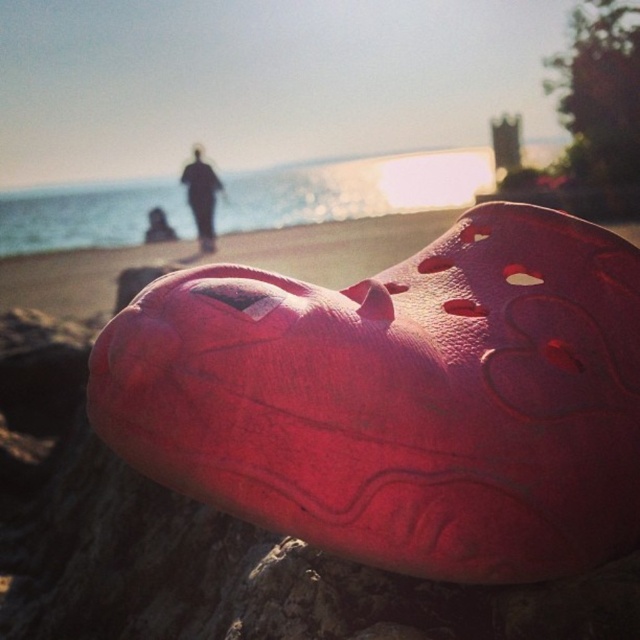
Based on the photo, is rubber/crocs shoe at center wider than black fabric person at center?

Indeed, rubber/crocs shoe at center has a greater width compared to black fabric person at center.

The width and height of the screenshot is (640, 640). What do you see at coordinates (401, 397) in the screenshot?
I see `rubber/crocs shoe at center` at bounding box center [401, 397].

Locate an element on the screen. This screenshot has width=640, height=640. rubber/crocs shoe at center is located at coordinates point(401,397).

Can you confirm if rubber/crocs shoe at center is positioned to the right of smooth black jacket at center?

Indeed, rubber/crocs shoe at center is positioned on the right side of smooth black jacket at center.

Does rubber/crocs shoe at center have a larger size compared to smooth black jacket at center?

Yes, rubber/crocs shoe at center is bigger than smooth black jacket at center.

Locate an element on the screen. rubber/crocs shoe at center is located at coordinates (401, 397).

The height and width of the screenshot is (640, 640). I want to click on rubber/crocs shoe at center, so click(401, 397).

Can you confirm if black fabric person at center is smaller than smooth black jacket at center?

Incorrect, black fabric person at center is not smaller in size than smooth black jacket at center.

Is the position of black fabric person at center less distant than that of smooth black jacket at center?

Yes.

Is point (204, 234) behind point (150, 228)?

That is False.

Identify the location of black fabric person at center. The width and height of the screenshot is (640, 640). (202, 198).